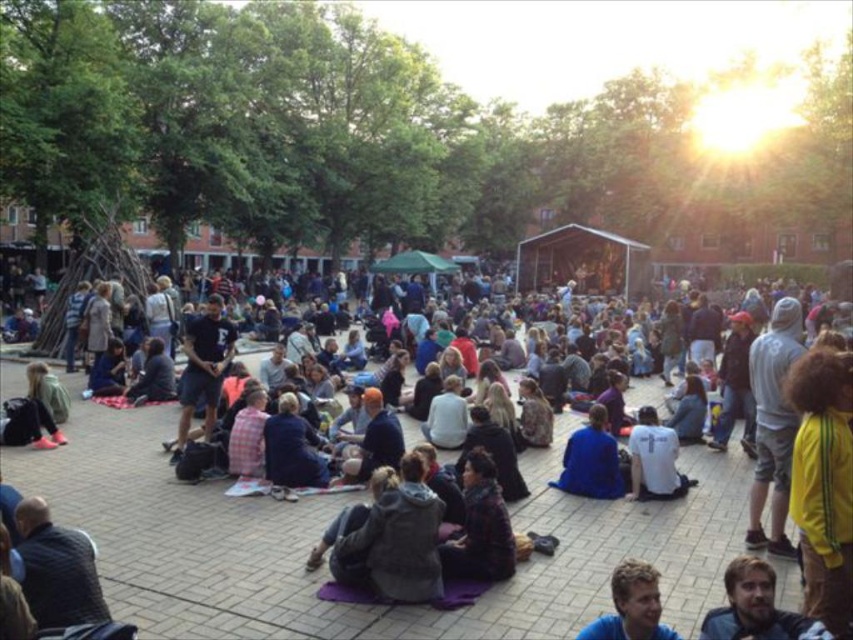
Question: Which point is closer to the camera?

Choices:
 (A) (585, 497)
 (B) (202, 618)

Answer: (B)

Question: Can you confirm if dark blue jacket at center is thinner than blue fabric at center?

Choices:
 (A) yes
 (B) no

Answer: (B)

Question: Is dark blue jacket at center positioned at the back of dark blue denim shorts at center?

Choices:
 (A) yes
 (B) no

Answer: (B)

Question: Which of the following is the closest to the observer?

Choices:
 (A) white t-shirt at center
 (B) blue fabric at center
 (C) dark blue jacket at center

Answer: (B)

Question: Does dark brown textured coat at center have a smaller size compared to blue fabric jacket at center?

Choices:
 (A) yes
 (B) no

Answer: (B)

Question: Among these points, which one is nearest to the camera?

Choices:
 (A) click(193, 352)
 (B) click(726, 580)
 (C) click(618, 628)
 (D) click(468, 554)

Answer: (C)